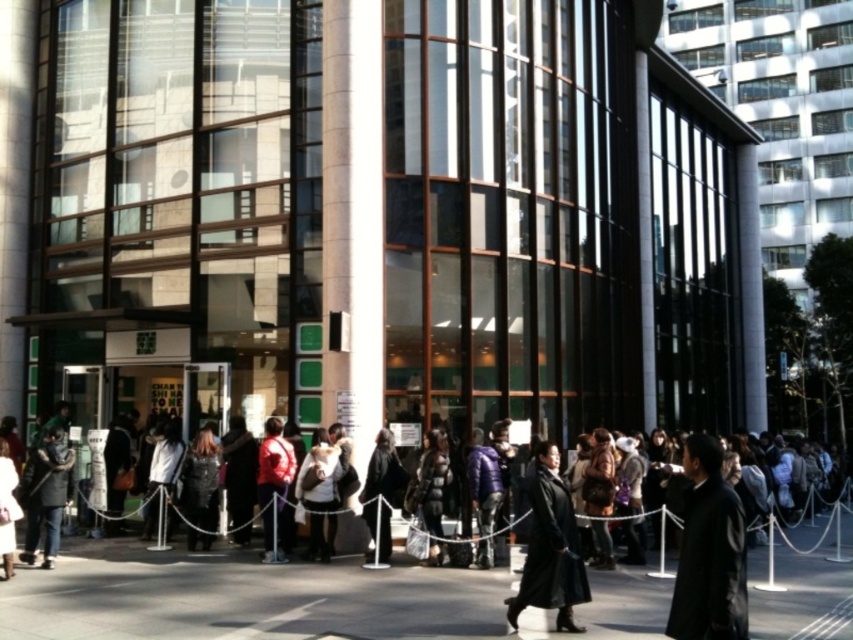
You are standing at the entrance of the modern building and want to locate the matte purple jacket at center. According to the coordinates provided, where should you look relative to the building?

The matte purple jacket at center is located at coordinates point (489, 484), which means it is positioned towards the right side and slightly below the center of the image. Since you are at the entrance facing the building, you should look to your right and slightly downward from the center point to find the matte purple jacket at center.

You are a photographer trying to capture both the black matte coat at center and the matte red jacket at center in a single shot. However, you can only focus on one subject at a time. Which subject should you focus on to ensure the other remains in the background?

You should focus on the black matte coat at center because it is in front of the matte red jacket at center, so if you focus on the front subject, the other will naturally be in the background.